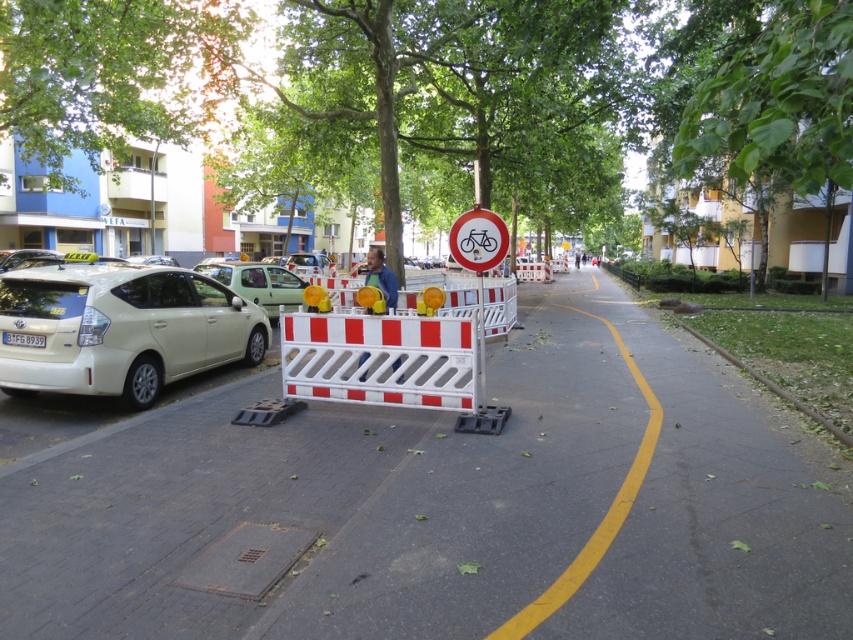
Who is taller, white matte hatchback at left or green leafy tree at upper center?

Standing taller between the two is green leafy tree at upper center.

Can you confirm if white matte hatchback at left is shorter than green leafy tree at upper center?

Indeed, white matte hatchback at left has a lesser height compared to green leafy tree at upper center.

Find the location of a particular element. The width and height of the screenshot is (853, 640). white matte hatchback at left is located at coordinates (119, 330).

Identify the location of white matte hatchback at left. (119, 330).

Which is below, green leafy tree at upper center or white plastic barricade at center?

Positioned lower is white plastic barricade at center.

Does green leafy tree at upper center have a greater height compared to white plastic barricade at center?

Correct, green leafy tree at upper center is much taller as white plastic barricade at center.

At what (x,y) coordinates should I click in order to perform the action: click on green leafy tree at upper center. Please return your answer as a coordinate pair (x, y). Looking at the image, I should click on (779, 108).

Between point (730, 92) and point (461, 243), which one is positioned in front?

Point (730, 92)

Can you confirm if green leafy tree at center is smaller than red circular sign with bicycle symbol at center?

Incorrect, green leafy tree at center is not smaller in size than red circular sign with bicycle symbol at center.

Is point (786, 154) farther from viewer compared to point (463, 253)?

No, (786, 154) is in front of (463, 253).

This screenshot has width=853, height=640. Identify the location of green leafy tree at center. (450, 86).